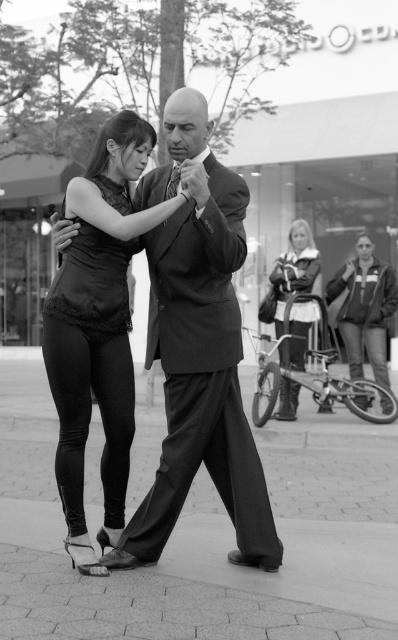
Question: Can you confirm if silky black dress at center is wider than velvet-like black dress at center?

Choices:
 (A) yes
 (B) no

Answer: (B)

Question: Which of the following is the farthest from the observer?

Choices:
 (A) satin black dress at center
 (B) smooth concrete pavement at center
 (C) velvet-like black dress at center
 (D) silky black dress at center

Answer: (C)

Question: Which object is closer to the camera taking this photo?

Choices:
 (A) smooth concrete pavement at center
 (B) velvet-like black dress at center
 (C) silky black dress at center

Answer: (A)

Question: Is satin black dress at center wider than silky black dress at center?

Choices:
 (A) no
 (B) yes

Answer: (B)

Question: Which object is positioned farthest from the velvet-like black dress at center?

Choices:
 (A) satin black dress at center
 (B) silky black dress at center

Answer: (B)

Question: In this image, where is smooth concrete pavement at center located relative to satin black dress at center?

Choices:
 (A) right
 (B) left

Answer: (A)